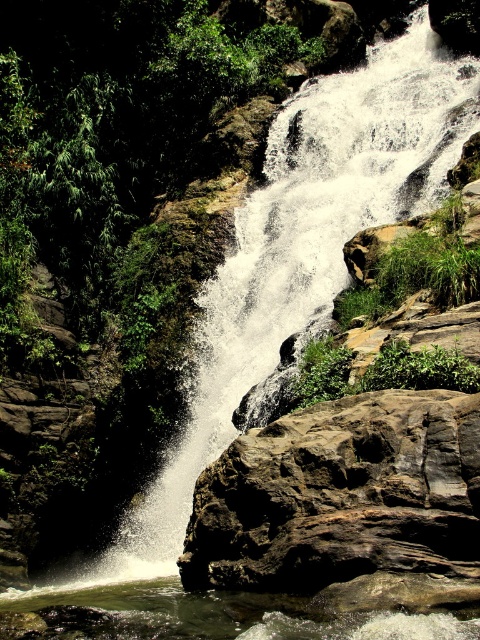
Question: Does brown rough rock at center appear on the left side of clear water at bottom center?

Choices:
 (A) no
 (B) yes

Answer: (A)

Question: Does brown rough rock at center appear over clear water at bottom center?

Choices:
 (A) no
 (B) yes

Answer: (B)

Question: Is brown rough rock at center further to camera compared to clear water at bottom center?

Choices:
 (A) yes
 (B) no

Answer: (A)

Question: Which of the following is the closest to the observer?

Choices:
 (A) clear water at bottom center
 (B) brown rough rock at center

Answer: (A)